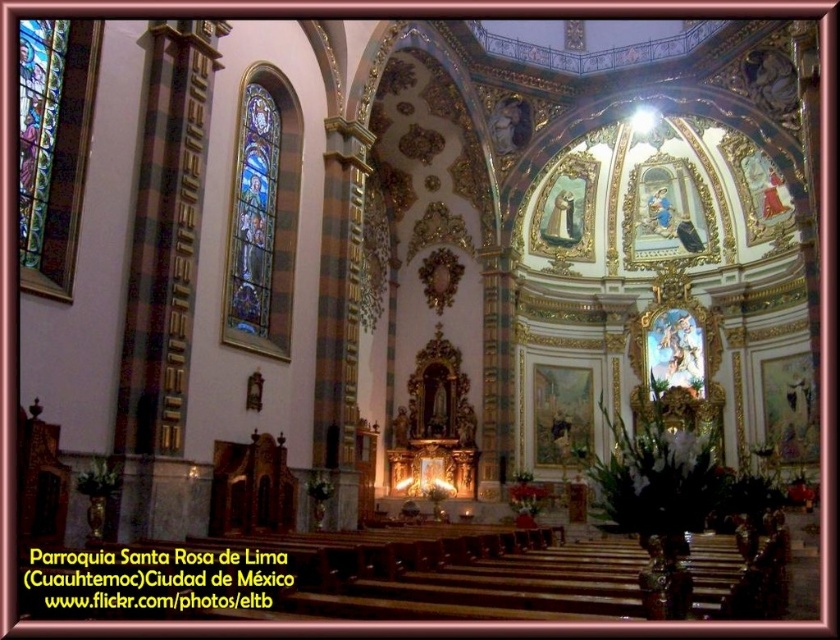
Does stained glass at left appear on the left side of stained glass window at left?

Incorrect, stained glass at left is not on the left side of stained glass window at left.

Can you confirm if stained glass at left is positioned above stained glass window at left?

No.

Between point (284, 326) and point (29, 44), which one is positioned in front?

Point (29, 44) is in front.

Find the location of a particular element. This screenshot has width=840, height=640. stained glass at left is located at coordinates pyautogui.click(x=263, y=216).